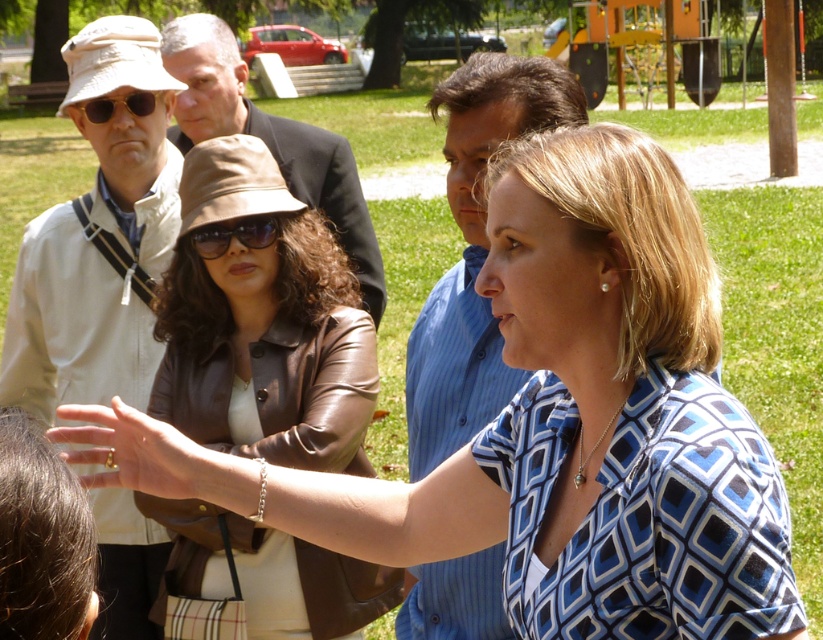
You are a photographer taking a picture of the two women in the park. The first woman is wearing a blue patterned blouse, and the second woman is wearing a brown leather jacket. You want to focus on the point at coordinates (263, 323). Based on the scene description, where exactly on the second woman should this point be located?

The point at coordinates (263, 323) is located on the brown leather jacket at upper center of the second woman.

You are a photographer trying to capture a photo of the dark brown suit at center. However, you notice the light beige fabric hat at upper left is blocking your view. Can you adjust your position to avoid the hat?

The light beige fabric hat at upper left is positioned under the dark brown suit at center, so moving your camera position slightly upwards might allow you to capture the dark brown suit at center without the hat obstructing the view.